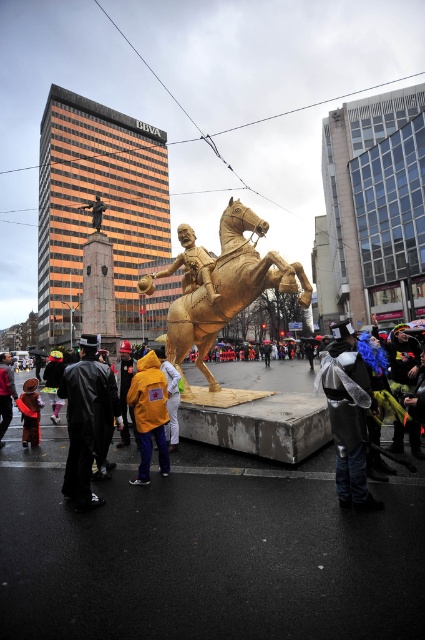
Between point (98, 381) and point (136, 406), which one is positioned in front?

Positioned in front is point (98, 381).

Does black leather coat at lower left appear on the left side of yellow matte jacket at center?

Correct, you'll find black leather coat at lower left to the left of yellow matte jacket at center.

Describe the element at coordinates (87, 420) in the screenshot. I see `black leather coat at lower left` at that location.

Where is `black leather coat at lower left`? black leather coat at lower left is located at coordinates (87, 420).

Which of these two, gold metallic horse at center or velvet red coat at lower left, stands shorter?

With less height is velvet red coat at lower left.

Is gold metallic horse at center smaller than velvet red coat at lower left?

Actually, gold metallic horse at center might be larger than velvet red coat at lower left.

Is point (221, 390) positioned after point (34, 396)?

Yes, point (221, 390) is behind point (34, 396).

Locate an element on the screen. The height and width of the screenshot is (640, 425). gold metallic horse at center is located at coordinates (227, 296).

Can you confirm if yellow matte jacket at center is shorter than velvet red coat at lower left?

No.

Between point (144, 394) and point (30, 385), which one is positioned in front?

Point (144, 394) is in front.

Which is in front, point (153, 356) or point (28, 381)?

Positioned in front is point (153, 356).

This screenshot has width=425, height=640. What are the coordinates of `yellow matte jacket at center` in the screenshot? It's located at (150, 413).